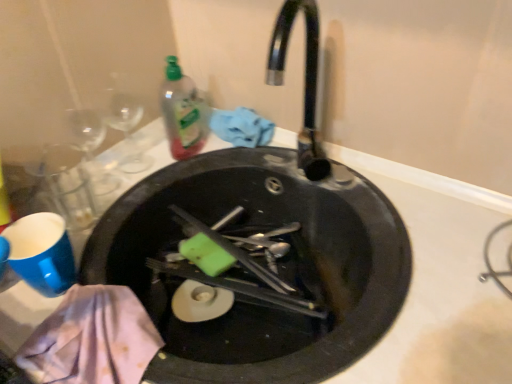
What are the coordinates of `free space in front of translucent plastic bottle at upper center` in the screenshot? It's located at (163, 192).